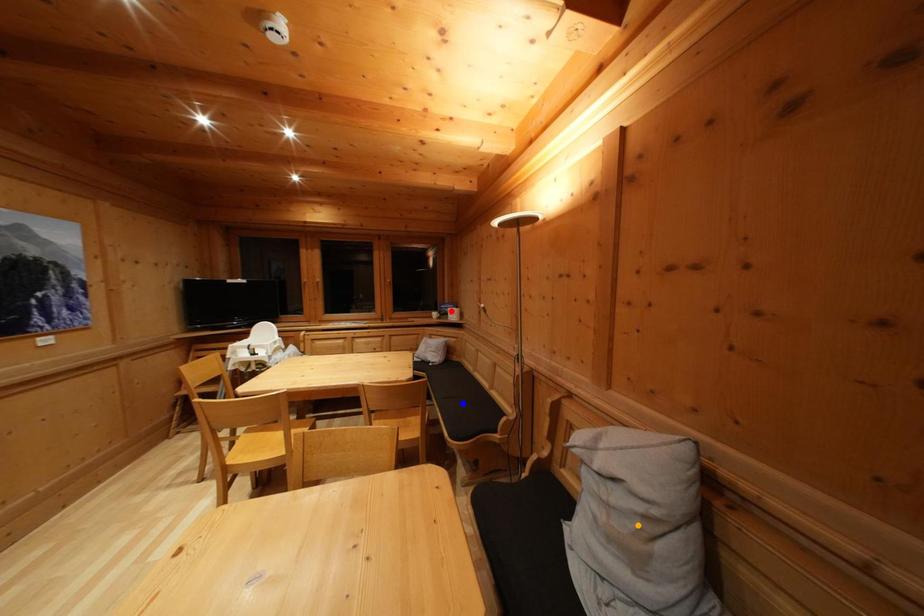
Order these from nearest to farthest:
- blue point
- red point
- orange point

orange point
blue point
red point